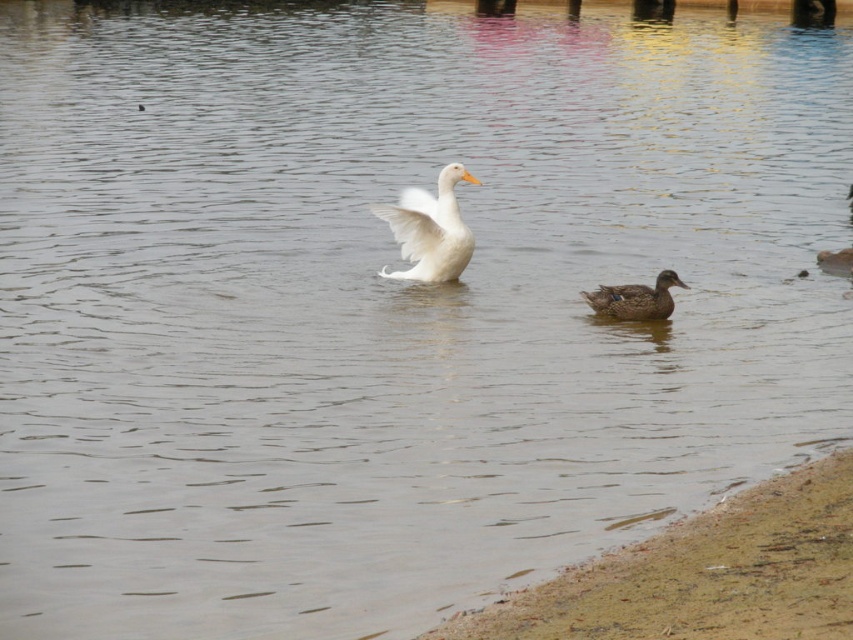
You are standing on the shore of the pond and see the brown sand at lower right and the dark brown glossy duck at lower right. Which object is closer to your right side?

The brown sand at lower right is closer to your right side because it is positioned to the right of the dark brown glossy duck at lower right.

You are standing on the shore of the pond and see the brown sand at lower right and the dark brown glossy duck at lower right. Which object is higher up in the image?

The brown sand at lower right is much taller than the dark brown glossy duck at lower right, so the brown sand at lower right is higher up in the image.